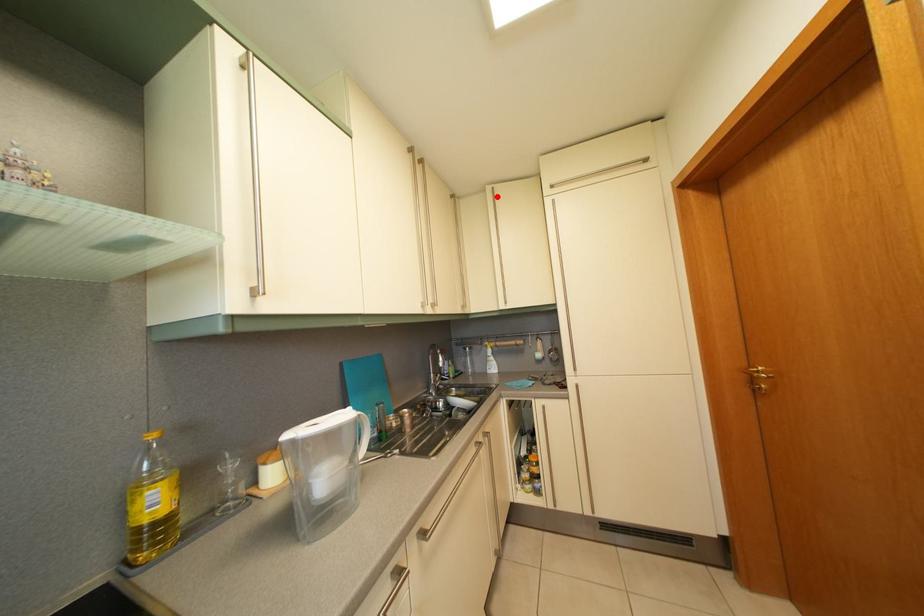
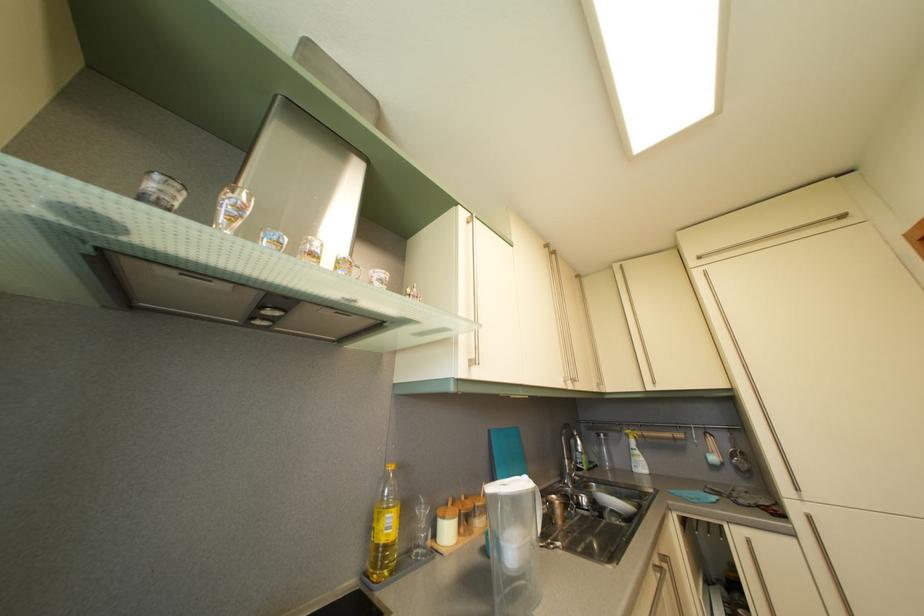
Locate, in the second image, the point that corresponds to the highlighted location in the first image.

(624, 274)